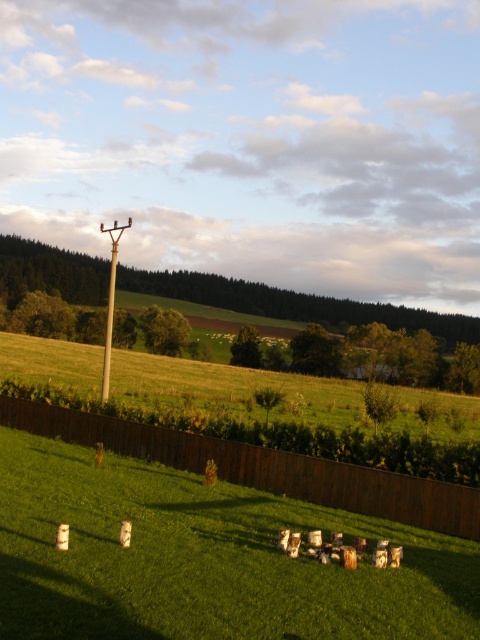
You are standing at the point with coordinates point [113,243] and want to walk towards the point with coordinates point [51,429]. Given the scene described, will you have to cross the wooden fence to reach your destination?

Point [51,429] is in front of point [113,243], so you will not have to cross the wooden fence to reach your destination.

You are standing in the rural landscape scene and want to take a photo of the brown wooden fence at lower center. To ensure it is centered in your camera viewfinder, where should you aim your camera? Please provide coordinates based on the image grid system where the bottom left corner is 0,0 and the top right corner is 1,1.

You should aim your camera at the coordinates (x=262, y=467) to center the brown wooden fence at lower center in your viewfinder.